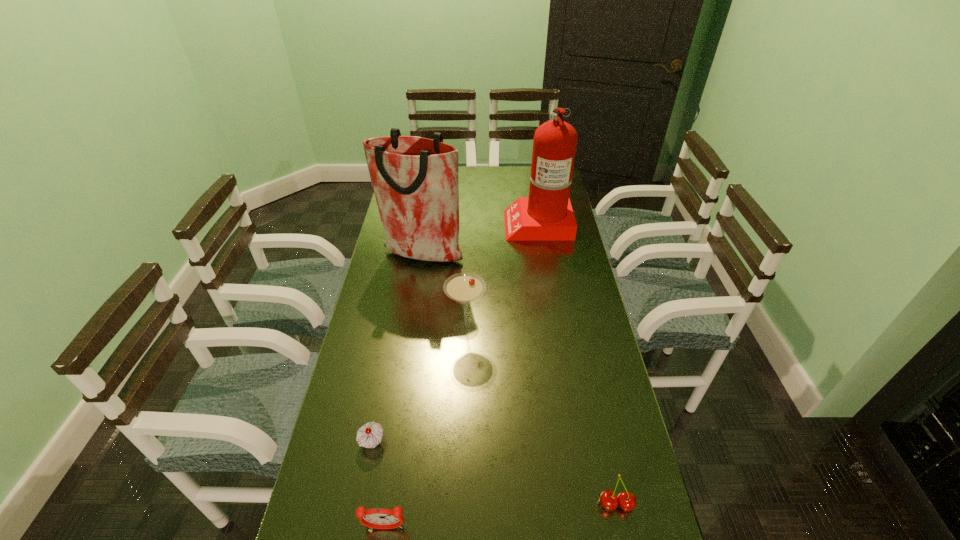
Locate an element on the screen. vacant region located 0.090m on the back of the grocery bag is located at coordinates (426, 227).

At what (x,y) coordinates should I click in order to perform the action: click on vacant space positioned 0.270m on the front of the martini. Please return your answer as a coordinate pair (x, y). This screenshot has height=540, width=960. Looking at the image, I should click on (463, 426).

The width and height of the screenshot is (960, 540). I want to click on blank space located 0.210m on the right of the cupcake, so click(x=468, y=442).

I want to click on grocery bag positioned at the left edge, so click(415, 180).

At what (x,y) coordinates should I click in order to perform the action: click on cupcake that is at the left edge. Please return your answer as a coordinate pair (x, y). Looking at the image, I should click on (369, 435).

Where is `alarm clock located at the left edge`? This screenshot has height=540, width=960. alarm clock located at the left edge is located at coordinates coord(378,518).

What are the coordinates of `fire extinguisher located at the right edge` in the screenshot? It's located at (546, 215).

Identify the location of cherry present at the right edge. This screenshot has height=540, width=960. (627, 501).

In the image, there is a desktop. Find the location of `vacant space at the far edge`. vacant space at the far edge is located at coordinates (483, 168).

Locate an element on the screen. free region at the left edge of the desktop is located at coordinates (369, 349).